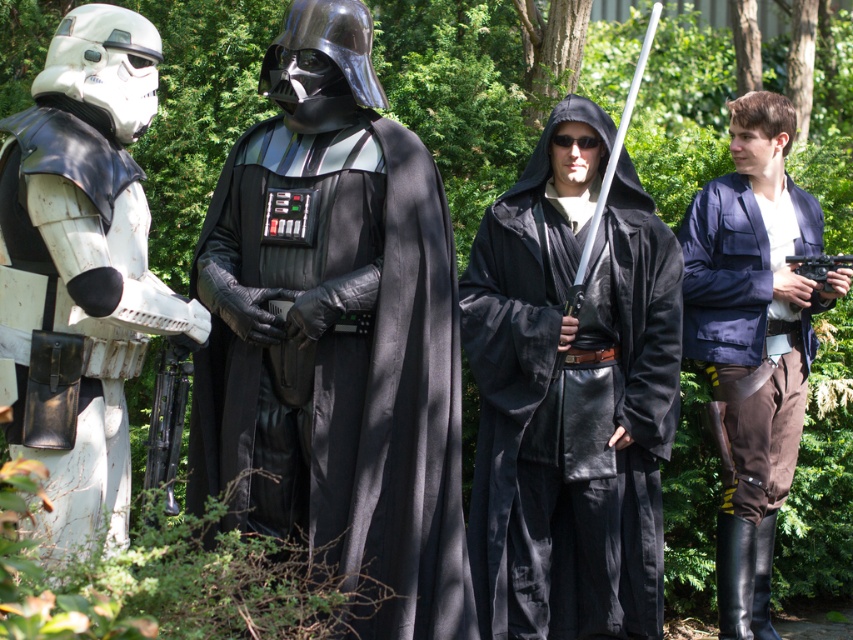
Is black leather cape at center taller than navy blue fabric jacket at right?

In fact, black leather cape at center may be shorter than navy blue fabric jacket at right.

In the scene shown: Does black leather cape at center appear on the left side of navy blue fabric jacket at right?

Yes, black leather cape at center is to the left of navy blue fabric jacket at right.

Who is more forward, (457, 381) or (688, 214)?

Positioned in front is point (457, 381).

At what (x,y) coordinates should I click in order to perform the action: click on black leather cape at center. Please return your answer as a coordinate pair (x, y). The width and height of the screenshot is (853, 640). Looking at the image, I should click on (339, 364).

Consider the image. Which is more to the right, black linen robe at center or navy blue fabric jacket at right?

Positioned to the right is navy blue fabric jacket at right.

Is black linen robe at center closer to the viewer compared to navy blue fabric jacket at right?

Yes, it is.

This screenshot has height=640, width=853. I want to click on black linen robe at center, so click(572, 394).

At what (x,y) coordinates should I click in order to perform the action: click on black linen robe at center. Please return your answer as a coordinate pair (x, y). Looking at the image, I should click on (572, 394).

Is point (404, 176) farther from camera compared to point (68, 308)?

Yes.

From the picture: Who is shorter, black leather cape at center or white matte armor at left?

white matte armor at left is shorter.

Describe the element at coordinates (339, 364) in the screenshot. The width and height of the screenshot is (853, 640). I see `black leather cape at center` at that location.

Identify the location of black leather cape at center. The width and height of the screenshot is (853, 640). (339, 364).